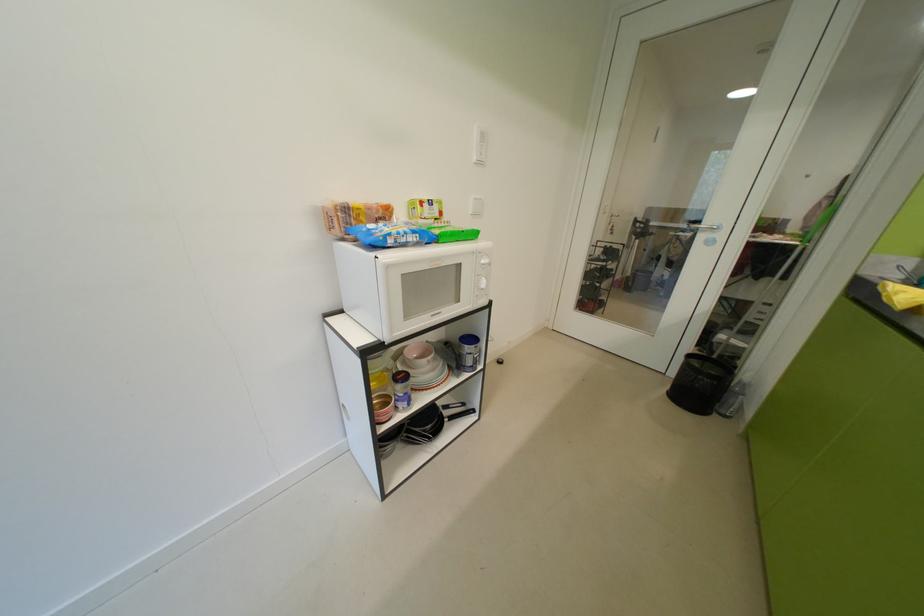
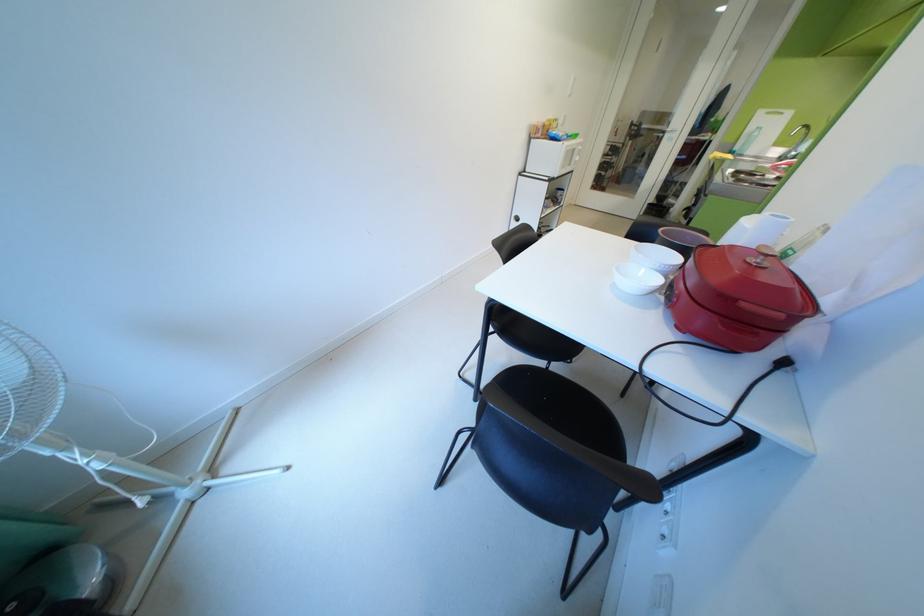
Based on the photo, in a continuous first-person perspective shot, in which direction is the camera moving?

The cameraman walked toward left, backward.